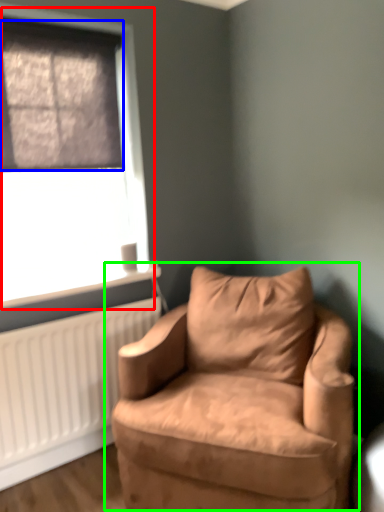
Question: Which is farther away from window (highlighted by a red box)? window screen (highlighted by a blue box) or chair (highlighted by a green box)?

Choices:
 (A) window screen
 (B) chair

Answer: (B)